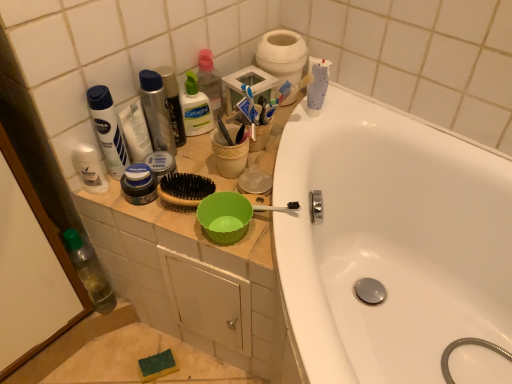
Question: Is the depth of transparent plastic bottle at lower left less than that of white matte lotion at upper left, which is the 2th toiletry in right-to-left order?

Choices:
 (A) no
 (B) yes

Answer: (A)

Question: From a real-world perspective, is transparent plastic bottle at lower left positioned over white matte lotion at upper left, which is the 2th toiletry in right-to-left order, based on gravity?

Choices:
 (A) yes
 (B) no

Answer: (B)

Question: Does transparent plastic bottle at lower left have a smaller size compared to white matte lotion at upper left, which is the 2th toiletry in right-to-left order?

Choices:
 (A) no
 (B) yes

Answer: (A)

Question: Is transparent plastic bottle at lower left next to white matte lotion at upper left, placed as the 2th toiletry when sorted from left to right, and touching it?

Choices:
 (A) yes
 (B) no

Answer: (B)

Question: Can you confirm if transparent plastic bottle at lower left is positioned to the right of white matte lotion at upper left, placed as the 2th toiletry when sorted from left to right?

Choices:
 (A) yes
 (B) no

Answer: (B)

Question: Does transparent plastic bottle at lower left have a greater width compared to white matte lotion at upper left, placed as the 2th toiletry when sorted from left to right?

Choices:
 (A) yes
 (B) no

Answer: (A)

Question: Considering the relative sizes of white matte lotion at upper left, which is the 2th toiletry in right-to-left order, and white matte toilet paper at upper center in the image provided, is white matte lotion at upper left, which is the 2th toiletry in right-to-left order, thinner than white matte toilet paper at upper center?

Choices:
 (A) no
 (B) yes

Answer: (B)

Question: Is white matte toilet paper at upper center surrounded by white matte lotion at upper left, which is the 2th toiletry in right-to-left order?

Choices:
 (A) yes
 (B) no

Answer: (B)

Question: Is white matte lotion at upper left, which is the 2th toiletry in right-to-left order, closer to camera compared to white matte toilet paper at upper center?

Choices:
 (A) no
 (B) yes

Answer: (B)

Question: Can you confirm if white matte lotion at upper left, which is the 2th toiletry in right-to-left order, is positioned to the left of white matte toilet paper at upper center?

Choices:
 (A) yes
 (B) no

Answer: (A)

Question: Can you confirm if white matte lotion at upper left, which is the 2th toiletry in right-to-left order, is positioned to the right of white matte toilet paper at upper center?

Choices:
 (A) yes
 (B) no

Answer: (B)

Question: Can you confirm if white matte lotion at upper left, which is the 2th toiletry in right-to-left order, is shorter than white matte toilet paper at upper center?

Choices:
 (A) no
 (B) yes

Answer: (A)

Question: Is white matte lotion at upper left, placed as the 2th toiletry when sorted from left to right, looking in the opposite direction of metallic silver mouthwash at center, which ranks as the 1th mouthwash in right-to-left order?

Choices:
 (A) no
 (B) yes

Answer: (A)